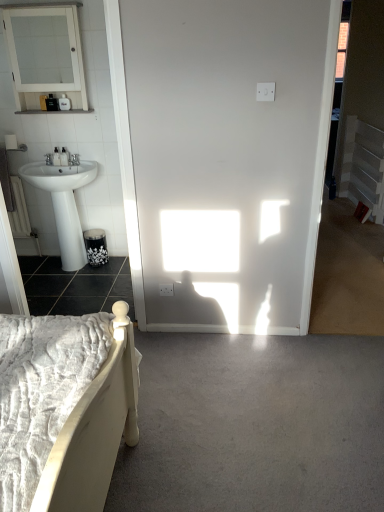
Question: From a real-world perspective, is gray carpet at lower center, which ranks as the second concrete in back-to-front order, located higher than matte black soap dispenser at upper left, which is the 1th toiletry in top-to-bottom order?

Choices:
 (A) yes
 (B) no

Answer: (B)

Question: Can you confirm if gray carpet at lower center, placed as the 2th concrete when sorted from left to right, is smaller than matte black soap dispenser at upper left, which appears as the third toiletry when ordered from the bottom?

Choices:
 (A) yes
 (B) no

Answer: (B)

Question: Can you confirm if gray carpet at lower center, arranged as the second concrete when viewed from the top, is thinner than matte black soap dispenser at upper left, which appears as the third toiletry when ordered from the bottom?

Choices:
 (A) yes
 (B) no

Answer: (B)

Question: Considering the relative positions of gray carpet at lower center, which ranks as the second concrete in back-to-front order, and matte black soap dispenser at upper left, which appears as the third toiletry when ordered from the bottom, in the image provided, is gray carpet at lower center, which ranks as the second concrete in back-to-front order, in front of matte black soap dispenser at upper left, which appears as the third toiletry when ordered from the bottom,?

Choices:
 (A) yes
 (B) no

Answer: (A)

Question: From the image's perspective, would you say gray carpet at lower center, the first concrete ordered from the bottom, is positioned over matte black soap dispenser at upper left, which appears as the third toiletry when ordered from the bottom?

Choices:
 (A) yes
 (B) no

Answer: (B)

Question: Is white glossy pedestal sink at left wider or thinner than gray carpet at lower center, the first concrete ordered from the bottom?

Choices:
 (A) thin
 (B) wide

Answer: (A)

Question: Would you say white glossy pedestal sink at left is inside or outside gray carpet at lower center, which ranks as the second concrete in back-to-front order?

Choices:
 (A) outside
 (B) inside

Answer: (A)

Question: Based on their sizes in the image, would you say white glossy pedestal sink at left is bigger or smaller than gray carpet at lower center, which ranks as the second concrete in back-to-front order?

Choices:
 (A) small
 (B) big

Answer: (B)

Question: Is point (77, 168) closer or farther from the camera than point (316, 436)?

Choices:
 (A) farther
 (B) closer

Answer: (A)

Question: Is black glossy concrete at lower left, which is counted as the 2th concrete, starting from the front, situated inside white glossy medicine cabinet at upper left or outside?

Choices:
 (A) inside
 (B) outside

Answer: (B)

Question: Considering the positions of black glossy concrete at lower left, acting as the second concrete starting from the right, and white glossy medicine cabinet at upper left in the image, is black glossy concrete at lower left, acting as the second concrete starting from the right, bigger or smaller than white glossy medicine cabinet at upper left?

Choices:
 (A) big
 (B) small

Answer: (A)

Question: Does point (96, 311) appear closer or farther from the camera than point (52, 84)?

Choices:
 (A) closer
 (B) farther

Answer: (A)

Question: In the image, is black glossy concrete at lower left, which appears as the 1th concrete when viewed from the top, positioned in front of or behind white glossy medicine cabinet at upper left?

Choices:
 (A) behind
 (B) front

Answer: (A)

Question: Is white plastic balustrade at right to the left or to the right of matte black soap dispenser at left, which ranks as the second toiletry in top-to-bottom order, in the image?

Choices:
 (A) left
 (B) right

Answer: (B)

Question: From the image's perspective, is white plastic balustrade at right located above or below matte black soap dispenser at left, which appears as the 2th toiletry when ordered from the bottom?

Choices:
 (A) below
 (B) above

Answer: (B)